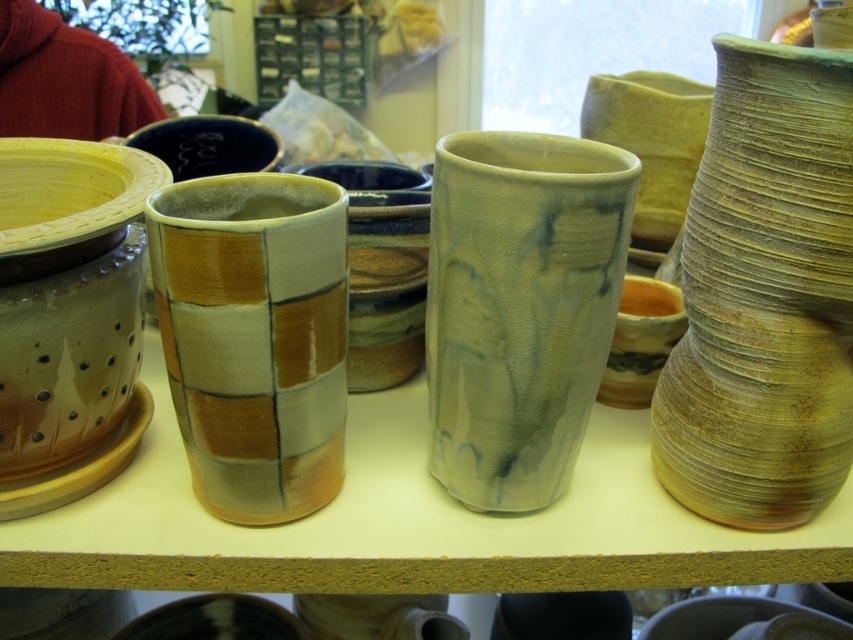
Question: Which of the following is the closest to the observer?

Choices:
 (A) (784, 524)
 (B) (444, 429)
 (C) (219, 385)

Answer: (C)

Question: Which of the following is the farthest from the observer?

Choices:
 (A) matte glazed vase at center
 (B) matte ceramic vase at center

Answer: (A)

Question: Is earthy clay vase at right above matte ceramic vase at center?

Choices:
 (A) yes
 (B) no

Answer: (A)

Question: Considering the relative positions of earthy clay vase at right and matte glazed vase at center in the image provided, where is earthy clay vase at right located with respect to matte glazed vase at center?

Choices:
 (A) right
 (B) left

Answer: (A)

Question: Can you confirm if earthy clay vase at right is positioned to the left of matte ceramic vase at center?

Choices:
 (A) no
 (B) yes

Answer: (A)

Question: Which of the following is the farthest from the observer?

Choices:
 (A) (537, 145)
 (B) (213, 278)
 (C) (711, 132)

Answer: (A)